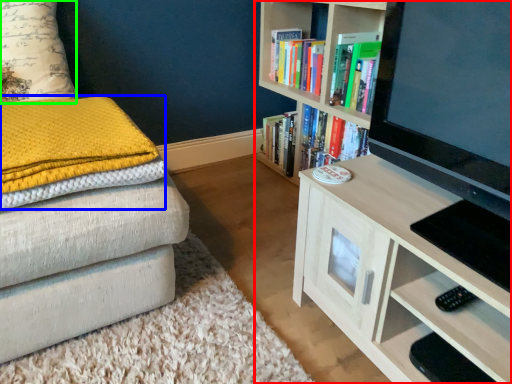
Question: Which object is the farthest from bookcase (highlighted by a red box)? Choose among these: blanket (highlighted by a blue box) or pillow (highlighted by a green box).

Choices:
 (A) blanket
 (B) pillow

Answer: (B)